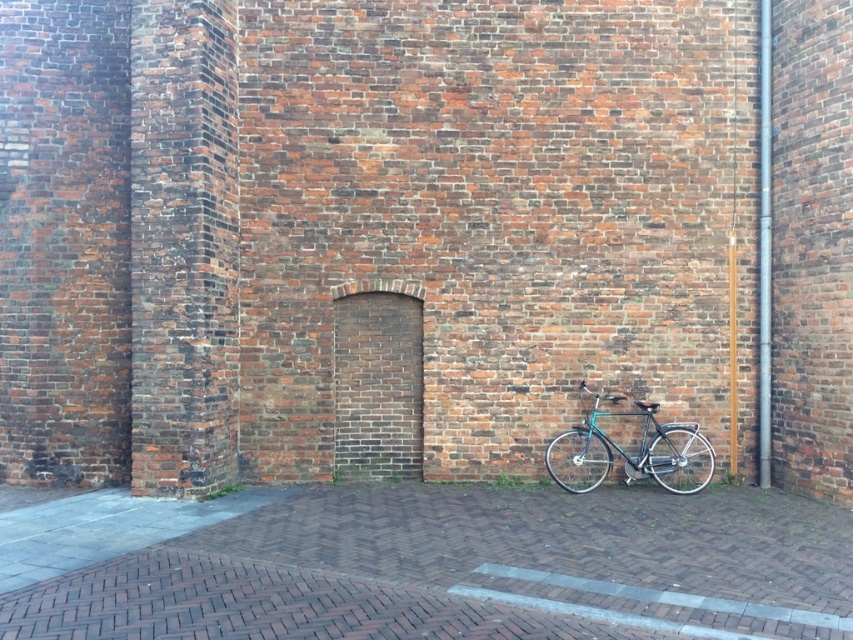
Based on the photo, you are standing in front of the brick wall and want to place a small potted plant on the brick pavement at lower right. However, you notice the teal glossy bicycle at lower right is nearby. Considering their heights, will the bicycle obstruct your view of the potted plant once it is placed?

The brick pavement at lower right is not as tall as the teal glossy bicycle at lower right. Since the bicycle is taller, it will likely block the view of the potted plant placed on the pavement.